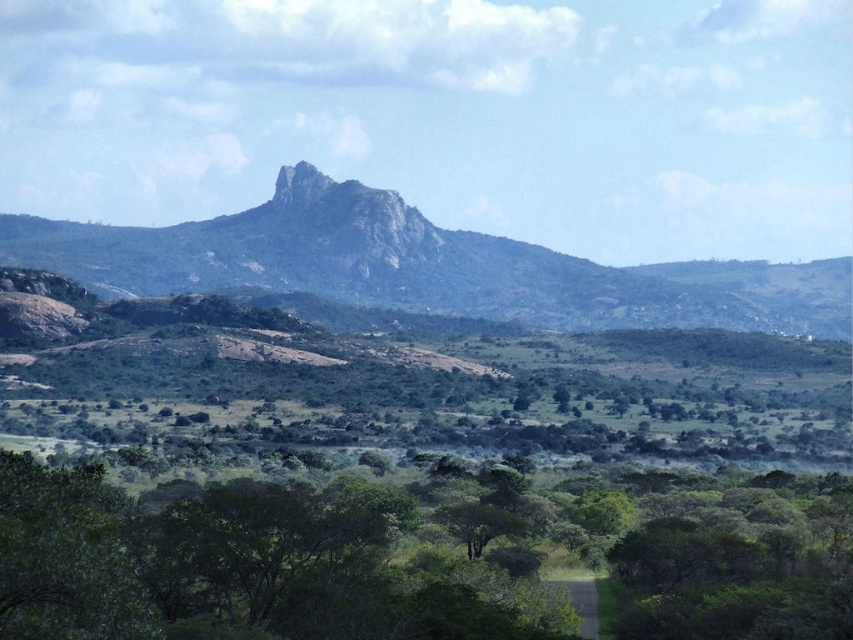
Question: Among these points, which one is nearest to the camera?

Choices:
 (A) (146, 612)
 (B) (556, 301)

Answer: (A)

Question: Does green leafy tree at lower center come behind rugged rock mountain at center?

Choices:
 (A) yes
 (B) no

Answer: (B)

Question: Can you confirm if green leafy tree at lower center is wider than rugged rock mountain at center?

Choices:
 (A) yes
 (B) no

Answer: (B)

Question: Which object is farther from the camera taking this photo?

Choices:
 (A) green leafy tree at lower center
 (B) rugged rock mountain at center

Answer: (B)

Question: Does green leafy tree at lower center appear over rugged rock mountain at center?

Choices:
 (A) yes
 (B) no

Answer: (B)